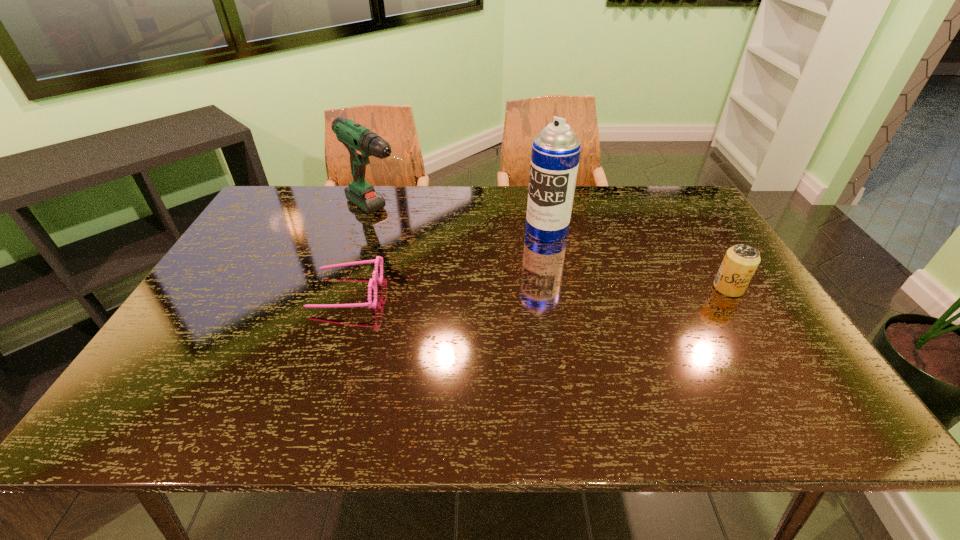
I want to click on spectacles, so click(x=379, y=259).

Where is `beer can`? The width and height of the screenshot is (960, 540). beer can is located at coordinates (741, 261).

The height and width of the screenshot is (540, 960). I want to click on the third tallest object, so click(741, 261).

Identify the location of the third shortest object. (361, 143).

The height and width of the screenshot is (540, 960). What are the coordinates of `the tallest object` in the screenshot? It's located at (555, 155).

Locate an element on the screen. The width and height of the screenshot is (960, 540). aerosol can is located at coordinates (555, 155).

The width and height of the screenshot is (960, 540). I want to click on free space located on the arms of the shortest object, so click(238, 292).

Where is `vacant space located 0.210m on the arms of the shortest object`? vacant space located 0.210m on the arms of the shortest object is located at coordinates (234, 292).

I want to click on free space located on the arms of the shortest object, so click(276, 292).

At what (x,y) coordinates should I click in order to perform the action: click on vacant space located on the left of the rightmost object. Please return your answer as a coordinate pair (x, y). The image size is (960, 540). Looking at the image, I should click on (594, 288).